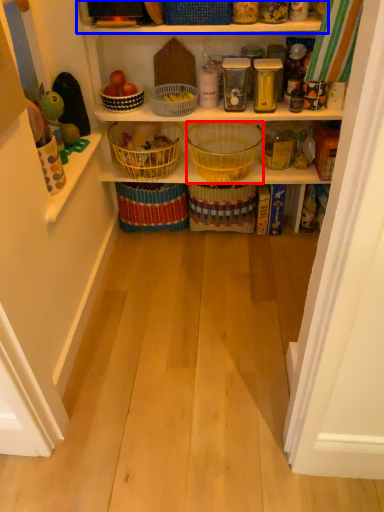
Question: Which object is further to the camera taking this photo, basket (highlighted by a red box) or shelf (highlighted by a blue box)?

Choices:
 (A) basket
 (B) shelf

Answer: (A)